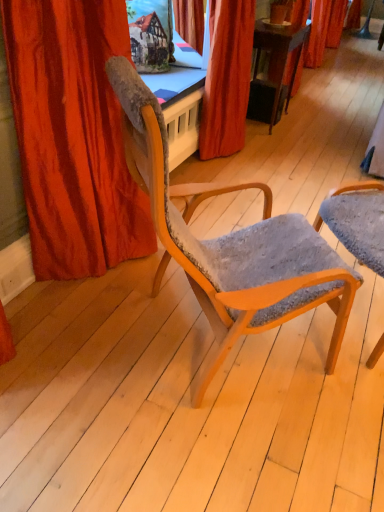
Question: Does textured gray fabric chair at center, marked as the first chair in a right-to-left arrangement, have a greater height compared to velvet red curtain at center, marked as the 1th curtain in a back-to-front arrangement?

Choices:
 (A) no
 (B) yes

Answer: (A)

Question: Is textured gray fabric chair at center, positioned as the second chair in left-to-right order, located outside velvet red curtain at center, the second curtain in the left-to-right sequence?

Choices:
 (A) yes
 (B) no

Answer: (A)

Question: Does textured gray fabric chair at center, marked as the first chair in a right-to-left arrangement, turn towards velvet red curtain at center, which is the 2th curtain in front-to-back order?

Choices:
 (A) no
 (B) yes

Answer: (A)

Question: From a real-world perspective, is textured gray fabric chair at center, positioned as the second chair in left-to-right order, on top of velvet red curtain at center, the second curtain in the left-to-right sequence?

Choices:
 (A) no
 (B) yes

Answer: (A)

Question: Is textured gray fabric chair at center, marked as the first chair in a right-to-left arrangement, positioned with its back to velvet red curtain at center, the second curtain in the left-to-right sequence?

Choices:
 (A) yes
 (B) no

Answer: (B)

Question: From the image's perspective, relative to wooden chair with textured fabric at center, the 1th chair in the left-to-right sequence, is textured gray fabric chair at center, marked as the first chair in a right-to-left arrangement, above or below?

Choices:
 (A) above
 (B) below

Answer: (B)

Question: From a real-world perspective, is textured gray fabric chair at center, marked as the first chair in a right-to-left arrangement, positioned above or below wooden chair with textured fabric at center, arranged as the 2th chair when viewed from the right?

Choices:
 (A) below
 (B) above

Answer: (A)

Question: Is textured gray fabric chair at center, positioned as the second chair in left-to-right order, taller or shorter than wooden chair with textured fabric at center, the 1th chair in the left-to-right sequence?

Choices:
 (A) short
 (B) tall

Answer: (A)

Question: Is textured gray fabric chair at center, positioned as the second chair in left-to-right order, inside the boundaries of wooden chair with textured fabric at center, arranged as the 2th chair when viewed from the right, or outside?

Choices:
 (A) inside
 (B) outside

Answer: (B)

Question: Based on their positions, is wooden chair with textured fabric at center, arranged as the 2th chair when viewed from the right, located to the left or right of textured gray fabric chair at center, marked as the first chair in a right-to-left arrangement?

Choices:
 (A) right
 (B) left

Answer: (B)

Question: Is wooden chair with textured fabric at center, arranged as the 2th chair when viewed from the right, inside the boundaries of textured gray fabric chair at center, marked as the first chair in a right-to-left arrangement, or outside?

Choices:
 (A) inside
 (B) outside

Answer: (B)

Question: Is wooden chair with textured fabric at center, arranged as the 2th chair when viewed from the right, taller or shorter than textured gray fabric chair at center, marked as the first chair in a right-to-left arrangement?

Choices:
 (A) tall
 (B) short

Answer: (A)

Question: From a real-world perspective, is wooden chair with textured fabric at center, arranged as the 2th chair when viewed from the right, above or below textured gray fabric chair at center, positioned as the second chair in left-to-right order?

Choices:
 (A) above
 (B) below

Answer: (A)

Question: Is textured gray fabric chair at center, positioned as the second chair in left-to-right order, taller or shorter than velvet red curtain at center, marked as the 1th curtain in a back-to-front arrangement?

Choices:
 (A) tall
 (B) short

Answer: (B)

Question: Is textured gray fabric chair at center, positioned as the second chair in left-to-right order, in front of or behind velvet red curtain at center, the second curtain in the left-to-right sequence, in the image?

Choices:
 (A) behind
 (B) front

Answer: (B)